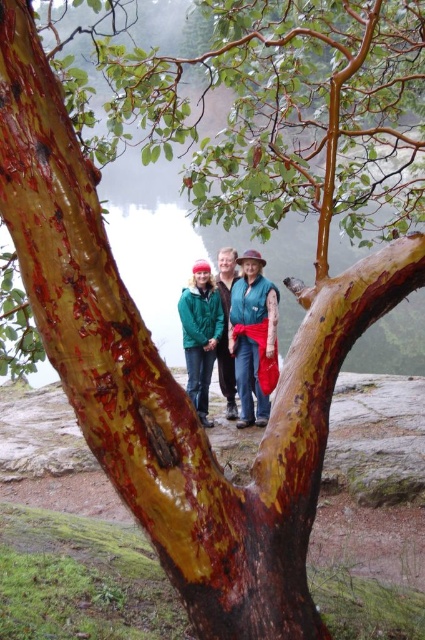
You are trying to identify two people in the image. You notice both the green fleece jacket at center and the green matte jacket at center. Which one is closer to you?

The green fleece jacket at center is closer to you because it is in front of the green matte jacket at center.

You are a photographer trying to capture a clear shot of the green fleece jacket at center and the green matte jacket at center. Since both are green, you want to ensure you focus on the correct one. According to the scene description, which jacket is positioned higher?

The green fleece jacket at center is positioned higher than the green matte jacket at center.